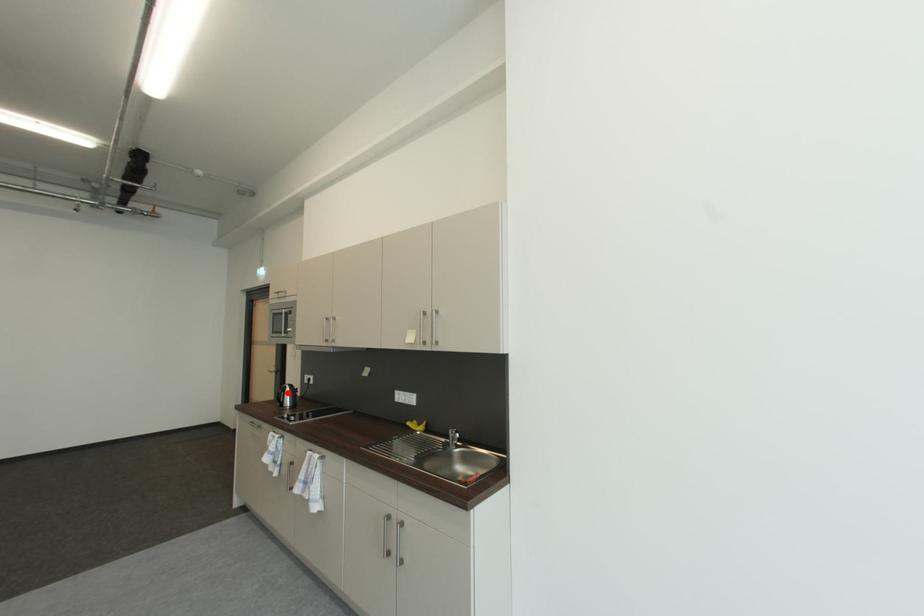
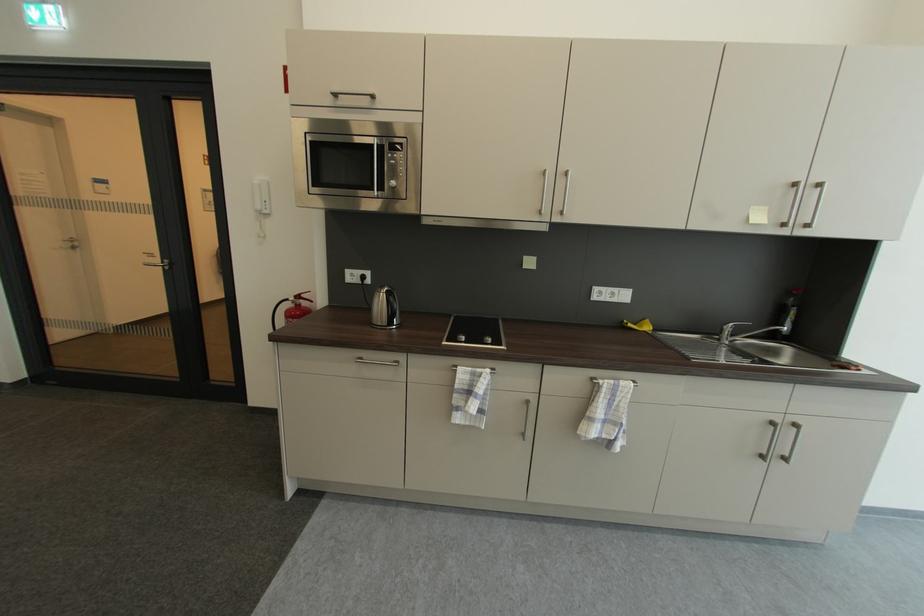
In the second image, find the point that corresponds to the highlighted location in the first image.

(397, 301)